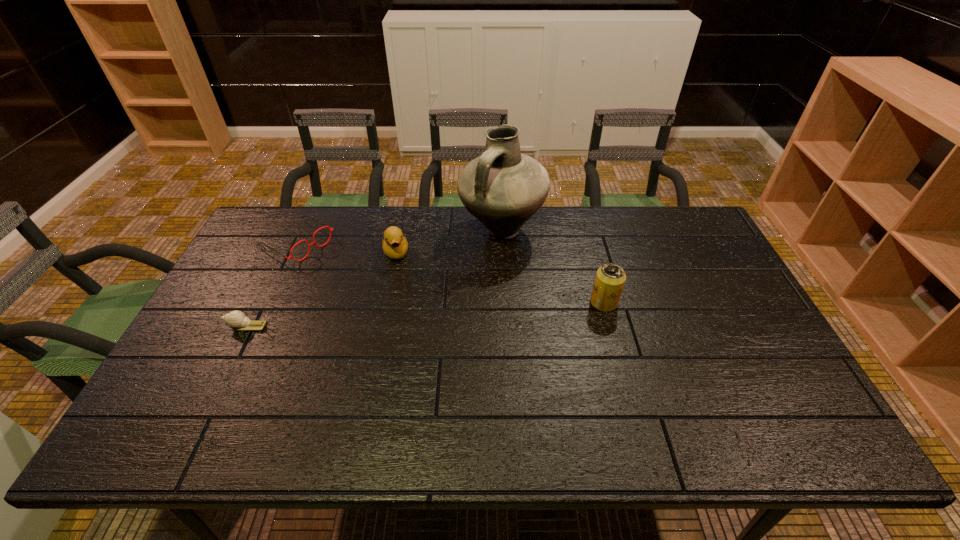
The height and width of the screenshot is (540, 960). Identify the location of free space located 0.060m on the shell of the nearest object. (204, 326).

Where is `vacant space located on the right of the second nearest object`? Image resolution: width=960 pixels, height=540 pixels. vacant space located on the right of the second nearest object is located at coordinates (655, 302).

Find the location of a particular element. vacant space located 0.210m on the face of the third object from left to right is located at coordinates (407, 313).

The image size is (960, 540). I want to click on vacant area situated 0.130m on the face of the third object from left to right, so coord(403,293).

The image size is (960, 540). I want to click on vacant space situated on the face of the third object from left to right, so click(x=414, y=348).

This screenshot has height=540, width=960. What are the coordinates of `vacant area located on the front-facing side of the spectacles` in the screenshot? It's located at (341, 267).

You are a GUI agent. You are given a task and a screenshot of the screen. Output one action in this format:
    pyautogui.click(x=<x>, y=<y>)
    Task: Click on the blank space located on the front-facing side of the spectacles
    
    Given the screenshot: What is the action you would take?
    pyautogui.click(x=382, y=291)

At what (x,y) coordinates should I click in order to perform the action: click on free point located 0.400m on the front-facing side of the spectacles. Please return your answer as a coordinate pair (x, y). Looking at the image, I should click on (416, 309).

Locate an element on the screen. vacant space situated on the handle side of the second object from right to left is located at coordinates (458, 350).

At what (x,y) coordinates should I click in order to perform the action: click on vacant space located on the handle side of the second object from right to left. Please return your answer as a coordinate pair (x, y). This screenshot has width=960, height=540. Looking at the image, I should click on (487, 270).